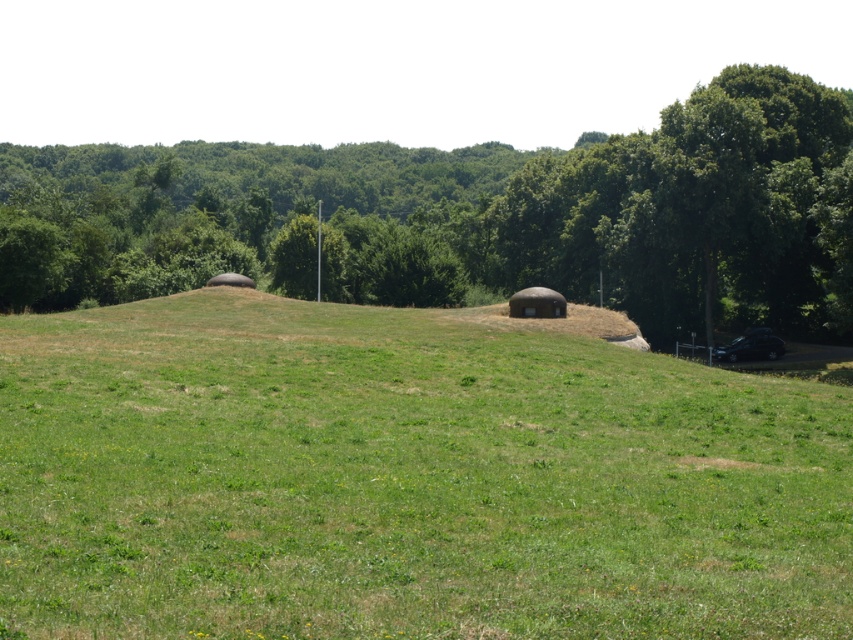
You are standing in the open grassy field and see the green grassy hill at center and the green leafy tree at center. Which object is closer to you?

The green grassy hill at center is closer to you because it is in front of the green leafy tree at center.